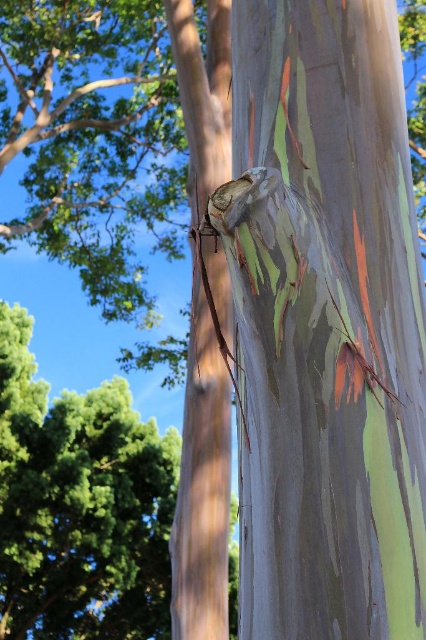
You are a botanist examining the eucalyptus tree bark in the image. You notice a specific point marked at coordinates (x=325, y=323). Based on the bark features, what structure does this point most likely correspond to?

The point at (x=325, y=323) corresponds to the multicolored bark tree trunk at center.

You are a botanist studying tree bark patterns. You observe the multicolored bark tree trunk at center in the image. Based on its position coordinates, can you determine if it is located in the upper half or lower half of the image?

The multicolored bark tree trunk at center is positioned at coordinates point (325, 323). Since the y coordinate 0.765 is above 0.5, it is in the upper half of the image.

You are standing in front of a eucalyptus tree and notice two points on its bark. The first point is at coordinates point (x=279, y=276) and the second is at point (x=190, y=221). Which of these points is nearer to you?

Point (x=279, y=276) is closer to the viewer than point (x=190, y=221).